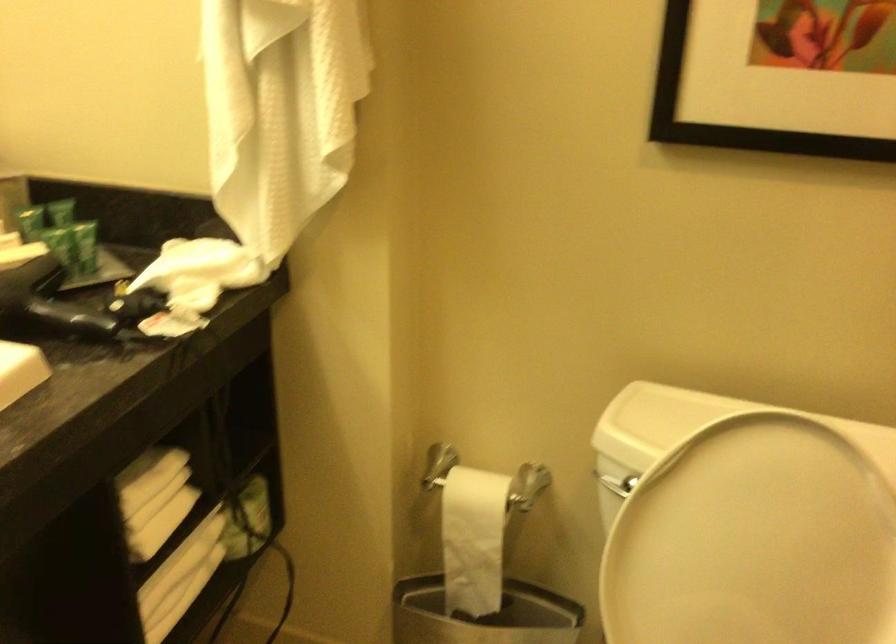
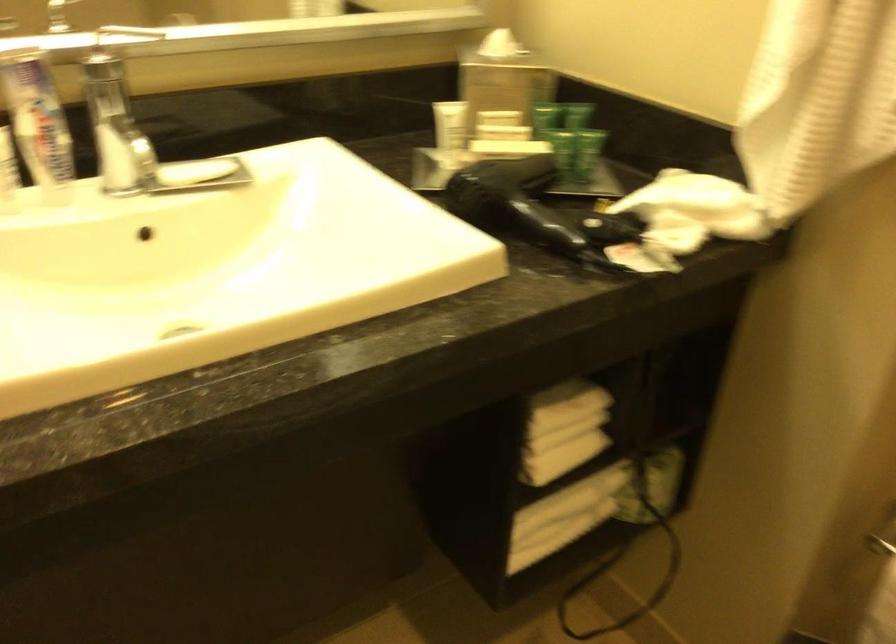
Question: The camera is either moving clockwise (left) or counter-clockwise (right) around the object. The first image is from the beginning of the video and the second image is from the end. Is the camera moving left or right when shooting the video?

Choices:
 (A) Left
 (B) Right

Answer: (B)